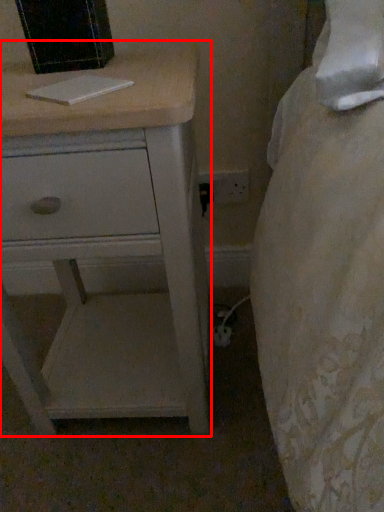
Question: Observing the image, what is the correct spatial positioning of chest of drawers (annotated by the red box) in reference to book?

Choices:
 (A) left
 (B) right

Answer: (A)